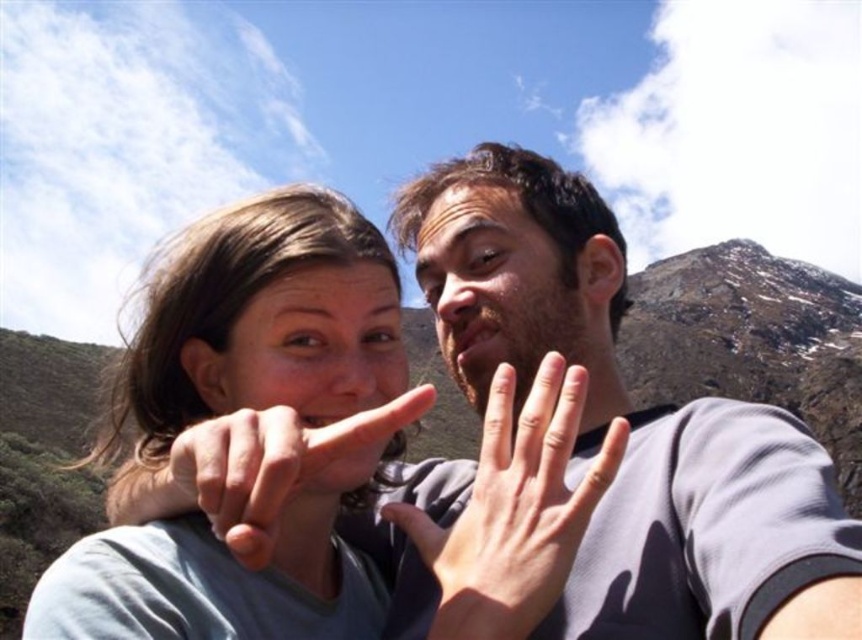
You are trying to determine the relative sizes of the objects in the scene. Which object is wider, the smooth skin hand at center or the brown matte beard at center?

The brown matte beard at center is wider than the smooth skin hand at center.

You are a photographer trying to focus on the subject in the image. Which object is closer to you, the smooth skin hand at center or the brown matte beard at center?

The smooth skin hand at center is closer to the viewer than the brown matte beard at center.

You are standing at the origin point in the image and want to reach the point that is closer to the camera. Which point should you head towards, point (431, 636) or point (214, 406)?

Point (431, 636) is in front of point (214, 406), so you should head towards point (431, 636) as it is closer to the camera.